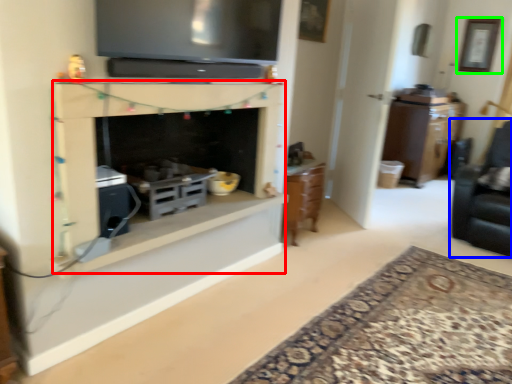
Question: Which object is positioned closest to fireplace (highlighted by a red box)? Select from swivel chair (highlighted by a blue box) and picture frame (highlighted by a green box).

Choices:
 (A) swivel chair
 (B) picture frame

Answer: (A)